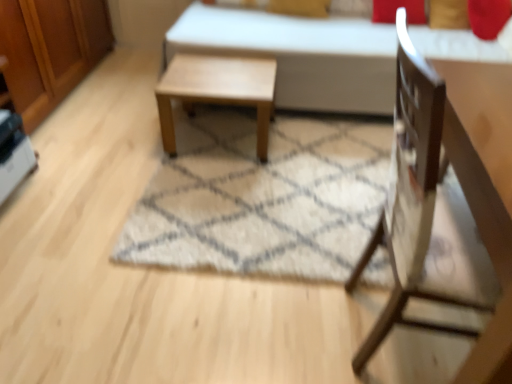
Measure the distance between point (201, 213) and camera.

They are 6.15 feet apart.

This screenshot has width=512, height=384. Describe the element at coordinates (217, 90) in the screenshot. I see `light brown wooden table at center` at that location.

Identify the location of wooden dresser at left. This screenshot has width=512, height=384. (50, 50).

The image size is (512, 384). I want to click on wooden chair at right, so click(428, 197).

In the scene shown: Is white shaggy rug at center directly adjacent to light brown wooden table at center?

white shaggy rug at center and light brown wooden table at center are clearly separated.

Is point (226, 159) farther from camera compared to point (265, 147)?

Yes, point (226, 159) is behind point (265, 147).

You are a GUI agent. You are given a task and a screenshot of the screen. Output one action in this format:
    pyautogui.click(x=<x>, y=<y>)
    Task: Click on the mat below the light brown wooden table at center (from the image's perspective)
    
    Given the screenshot: What is the action you would take?
    pyautogui.click(x=262, y=196)

Looking at their sizes, would you say light brown wooden table at center is wider or thinner than wooden chair at right?

Considering their sizes, light brown wooden table at center looks slimmer than wooden chair at right.

Looking at this image, between light brown wooden table at center and wooden chair at right, which one has larger size?

With larger size is wooden chair at right.

Is light brown wooden table at center oriented away from wooden chair at right?

light brown wooden table at center is not turned away from wooden chair at right.

Is point (197, 81) closer or farther from the camera than point (475, 149)?

Point (197, 81) is farther from the camera than point (475, 149).

Does wooden chair at right have a greater width compared to wooden dresser at left?

Correct, the width of wooden chair at right exceeds that of wooden dresser at left.

At what (x,y) coordinates should I click in order to perform the action: click on chair located in front of the wooden dresser at left. Please return your answer as a coordinate pair (x, y). Looking at the image, I should click on (428, 197).

Which is less distant, (403, 249) or (98, 41)?

The point (403, 249) is in front.

Consider the image. Which is nearer, (481, 41) or (436, 207)?

Point (481, 41).

From a real-world perspective, relative to white shaggy rug at center, is white fabric bed at center vertically above or below?

In terms of real-world spatial position, white fabric bed at center is above white shaggy rug at center.

Looking at this image, considering the positions of objects white fabric bed at center and white shaggy rug at center in the image provided, who is more to the left, white fabric bed at center or white shaggy rug at center?

white shaggy rug at center is more to the left.

From the image's perspective, relative to white shaggy rug at center, is white fabric bed at center above or below?

Clearly, from the image's perspective, white fabric bed at center is above white shaggy rug at center.

Consider the image. Would you consider light brown wooden table at center to be distant from wooden dresser at left?

No, light brown wooden table at center is not far from wooden dresser at left.

Is point (230, 100) positioned before point (44, 11)?

Yes, point (230, 100) is in front of point (44, 11).

Is light brown wooden table at center to the left or to the right of wooden dresser at left in the image?

From the image, it's evident that light brown wooden table at center is to the right of wooden dresser at left.

Looking at this image, is light brown wooden table at center not inside wooden dresser at left?

That's correct, light brown wooden table at center is outside of wooden dresser at left.

Is light brown wooden table at center looking in the opposite direction of white fabric bed at center?

Yes, light brown wooden table at center is facing away from white fabric bed at center.

Between light brown wooden table at center and white fabric bed at center, which one has smaller width?

light brown wooden table at center.

This screenshot has height=384, width=512. Find the location of `table below the white fabric bed at center (from the image's perspective)`. table below the white fabric bed at center (from the image's perspective) is located at coordinates (217, 90).

Is light brown wooden table at center in contact with white fabric bed at center?

No, light brown wooden table at center is not beside white fabric bed at center.

Which is less distant, (318,31) or (163,100)?

The point (163,100) is more forward.

Relative to light brown wooden table at center, is white fabric bed at center in front or behind?

Clearly, white fabric bed at center is behind light brown wooden table at center.

What's the angular difference between white fabric bed at center and light brown wooden table at center's facing directions?

There is a 1.77-degree angle between the facing directions of white fabric bed at center and light brown wooden table at center.

In the image, there is a light brown wooden table at center. At what (x,y) coordinates should I click in order to perform the action: click on bed above it (from the image's perspective). Please return your answer as a coordinate pair (x, y). The height and width of the screenshot is (384, 512). Looking at the image, I should click on (300, 55).

Where is `mat to the right of light brown wooden table at center`? The image size is (512, 384). mat to the right of light brown wooden table at center is located at coordinates (262, 196).

Where is `table on the left of the wooden chair at right`? This screenshot has height=384, width=512. table on the left of the wooden chair at right is located at coordinates (217, 90).

Considering their positions, is white fabric bed at center positioned further to light brown wooden table at center than wooden dresser at left?

The object further to light brown wooden table at center is wooden dresser at left.

Based on their spatial positions, is wooden dresser at left or white fabric bed at center closer to light brown wooden table at center?

Among the two, white fabric bed at center is located nearer to light brown wooden table at center.

Looking at the image, which one is located further to light brown wooden table at center, wooden dresser at left or wooden chair at right?

wooden chair at right lies further to light brown wooden table at center than the other object.

Estimate the real-world distances between objects in this image. Which object is closer to wooden chair at right, white fabric bed at center or white shaggy rug at center?

white shaggy rug at center lies closer to wooden chair at right than the other object.

From the image, which object appears to be nearer to white fabric bed at center, wooden chair at right or wooden dresser at left?

wooden dresser at left is positioned closer to the anchor white fabric bed at center.

When comparing their distances from wooden chair at right, does light brown wooden table at center or wooden dresser at left seem further?

wooden dresser at left is positioned further to the anchor wooden chair at right.

Looking at the image, which one is located closer to white shaggy rug at center, light brown wooden table at center or white fabric bed at center?

Based on the image, light brown wooden table at center appears to be nearer to white shaggy rug at center.

Based on their spatial positions, is light brown wooden table at center or white shaggy rug at center closer to white fabric bed at center?

light brown wooden table at center is positioned closer to the anchor white fabric bed at center.

This screenshot has height=384, width=512. Identify the location of bed between wooden dresser at left and wooden chair at right from left to right. (300, 55).

Where is `table between wooden dresser at left and wooden chair at right`? This screenshot has width=512, height=384. table between wooden dresser at left and wooden chair at right is located at coordinates (217, 90).

Find the location of `table between wooden dresser at left and white fabric bed at center`. table between wooden dresser at left and white fabric bed at center is located at coordinates (217, 90).

Locate an element on the screen. This screenshot has width=512, height=384. table between wooden dresser at left and white shaggy rug at center is located at coordinates (217, 90).